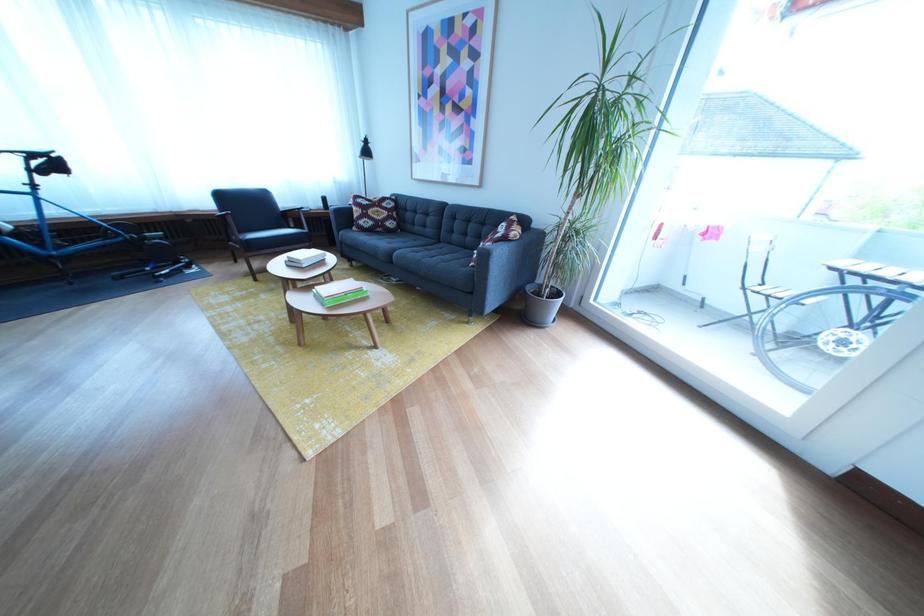
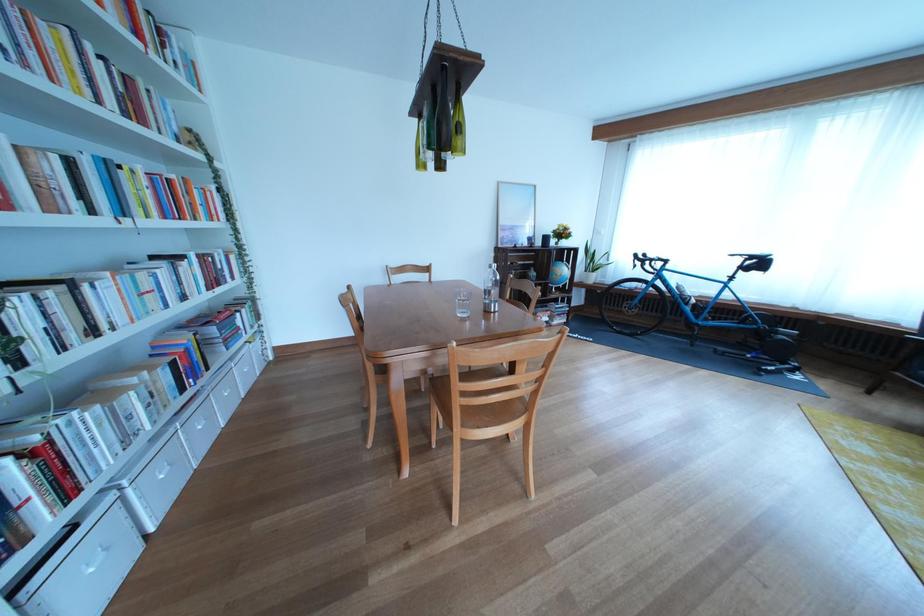
Question: How did the camera likely rotate?

Choices:
 (A) Left
 (B) Right
 (C) Up
 (D) Down

Answer: (A)